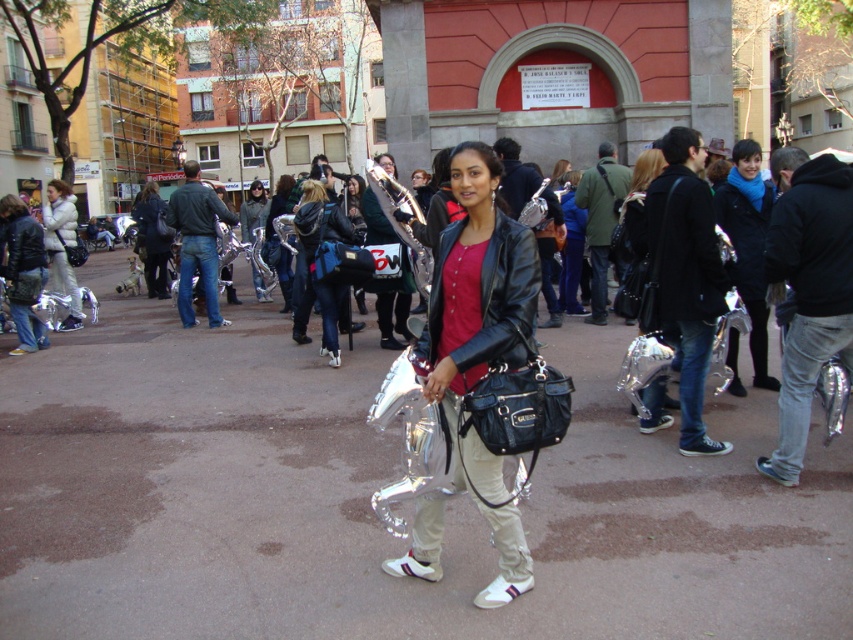
Describe the element at coordinates (479, 340) in the screenshot. This screenshot has height=640, width=853. I see `matte black jacket at center` at that location.

Is point (456, 292) positioned behind point (654, 387)?

That is False.

Locate an element on the screen. matte black jacket at center is located at coordinates (479, 340).

Is matte black jacket at center thinner than white puffy jacket at left?

Correct, matte black jacket at center's width is less than white puffy jacket at left's.

Does matte black jacket at center have a greater width compared to white puffy jacket at left?

No.

Describe the element at coordinates (479, 340) in the screenshot. This screenshot has height=640, width=853. I see `matte black jacket at center` at that location.

Locate an element on the screen. Image resolution: width=853 pixels, height=640 pixels. matte black jacket at center is located at coordinates (479, 340).

How far apart are black leather jacket at center and white puffy jacket at left?

The distance of black leather jacket at center from white puffy jacket at left is 27.62 feet.

Measure the distance between black leather jacket at center and white puffy jacket at left.

black leather jacket at center is 8.42 meters from white puffy jacket at left.

Is point (688, 342) positioned behind point (48, 257)?

No, (688, 342) is in front of (48, 257).

Where is `black leather jacket at center`? black leather jacket at center is located at coordinates (686, 275).